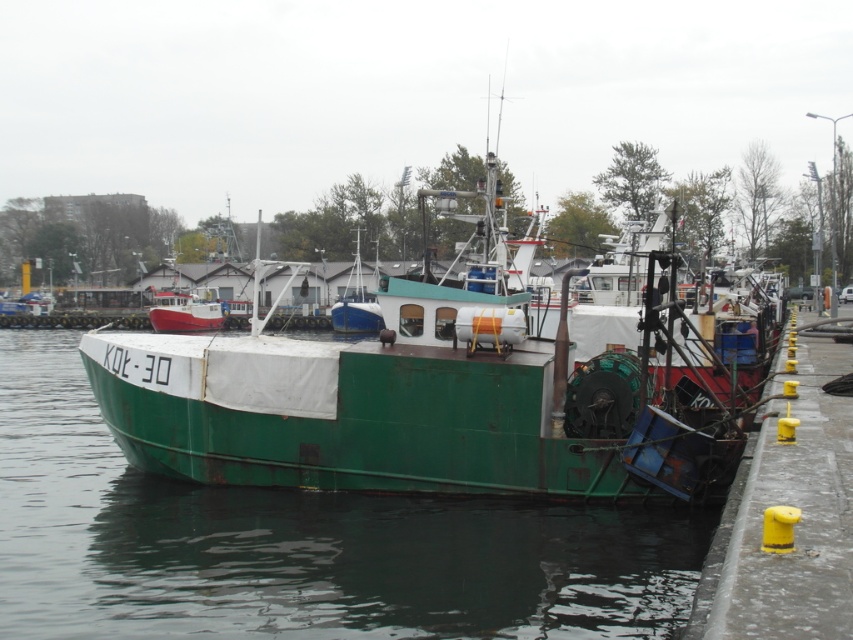
You are standing on the dock near the fishing vessel KO?L?30. You need to locate the green matte water at center. According to the coordinates provided, where exactly should you look?

The green matte water at center is located at the coordinates point (299, 544).

You are a harbor inspector checking the coordinates of vessels. The harbor requires all boats to be docked within the central zone defined by coordinates between 0.5 and 0.6 on the x and y axes. Is the green matte boat at center within the required coordinates?

The green matte boat at center is positioned at coordinates (448, 387). Since both values fall within the range of 0.5 to 0.6, it is within the required central zone.

You are standing on the dock and see the green matte water at center and the yellow rubber bollard at lower right. Which object is closer to you?

The yellow rubber bollard at lower right is closer to you because the green matte water at center is further away.